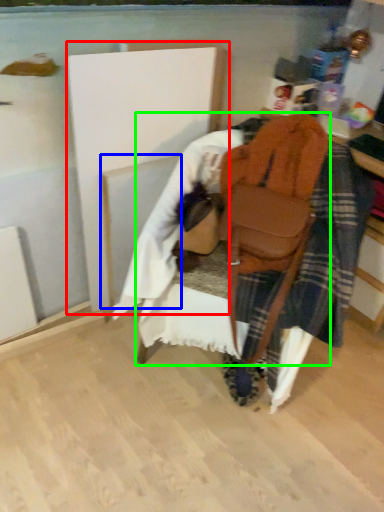
Question: Which object is the farthest from wood (highlighted by a red box)? Choose among these: wood (highlighted by a blue box) or furniture (highlighted by a green box).

Choices:
 (A) wood
 (B) furniture

Answer: (B)